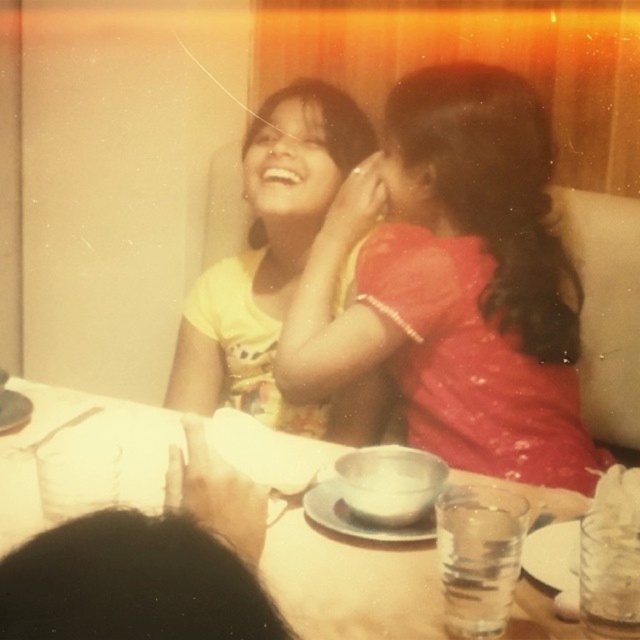
You are a photographer who wants to ensure that the yellow printed fabric at upper left and the black hair at lower left are both visible in your composition. Based on their sizes, which object should you prioritize framing closer to the camera to maintain detail?

The yellow printed fabric at upper left is wider than the black hair at lower left, so to maintain detail, you should prioritize framing the yellow printed fabric at upper left closer to the camera.

You are a photographer adjusting the lighting for a portrait. You notice the matte red dress at center and the black hair at lower left in the frame. Which object should you adjust the light towards to ensure both are well lit without moving the subjects?

The matte red dress at center is to the right of the black hair at lower left. To ensure both are well lit, adjust the light towards the black hair at lower left so that the light reaches both objects since the matte red dress at center is positioned to its right.